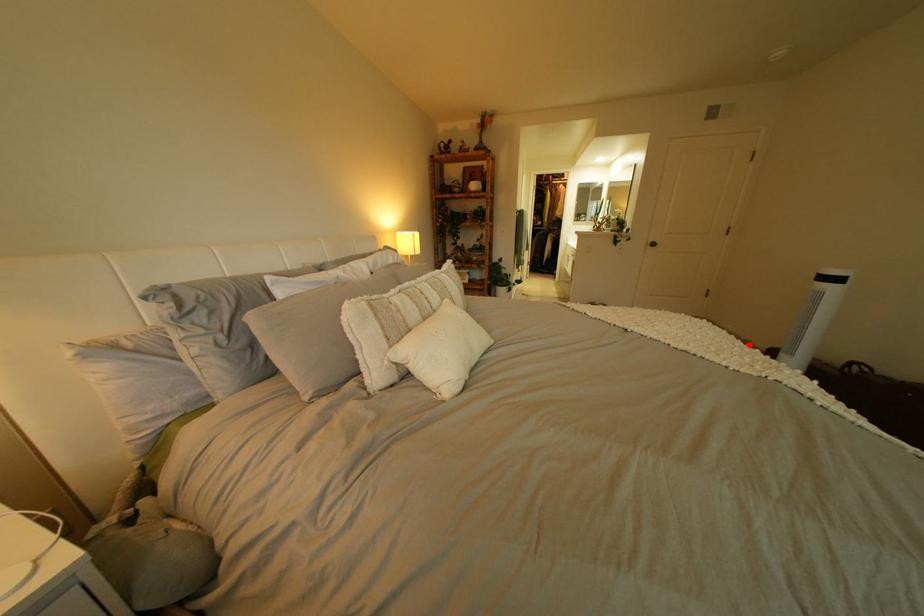
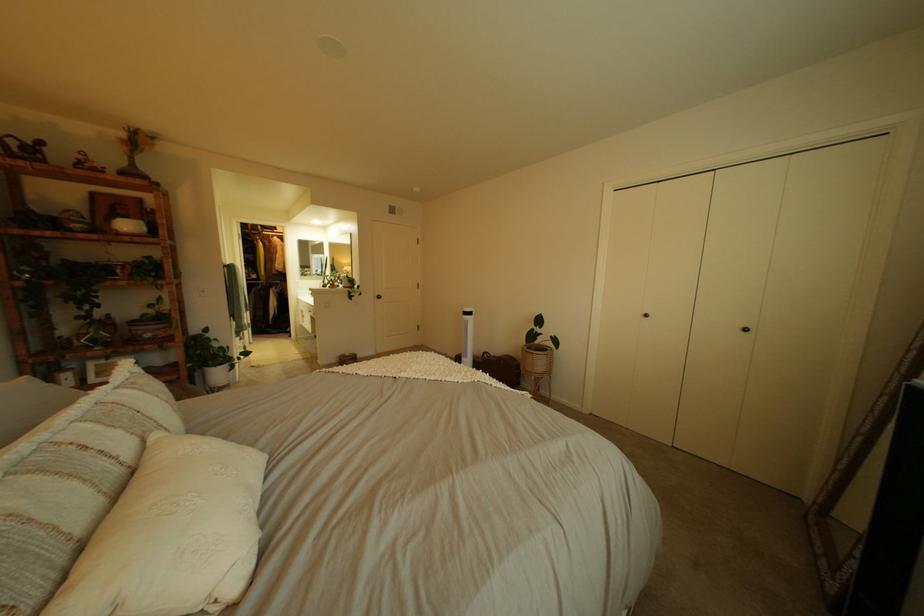
The point at the highlighted location is marked in the first image. Where is the corresponding point in the second image?

(468, 365)